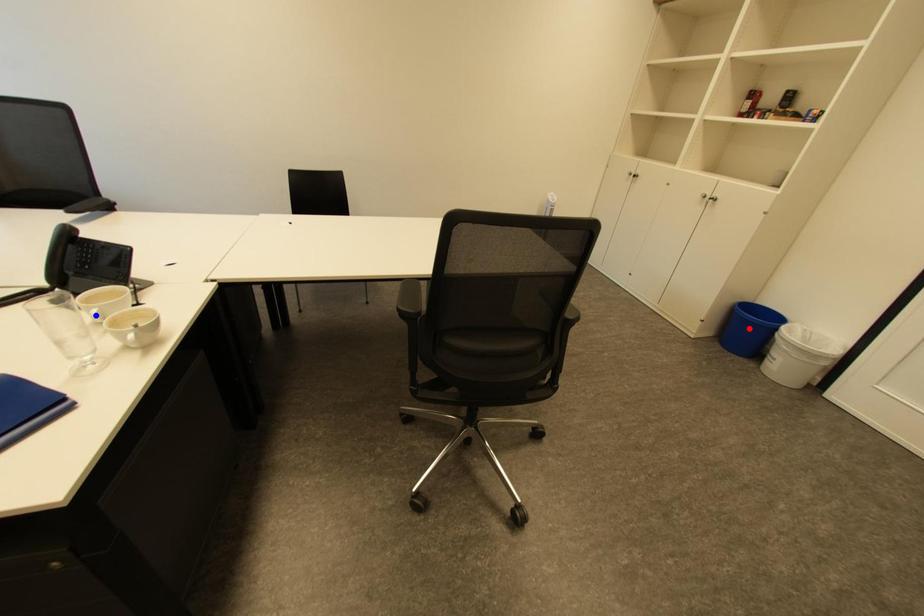
Question: Two points are marked on the image. Which point is closer to the camera?

Choices:
 (A) Blue point is closer.
 (B) Red point is closer.

Answer: (A)